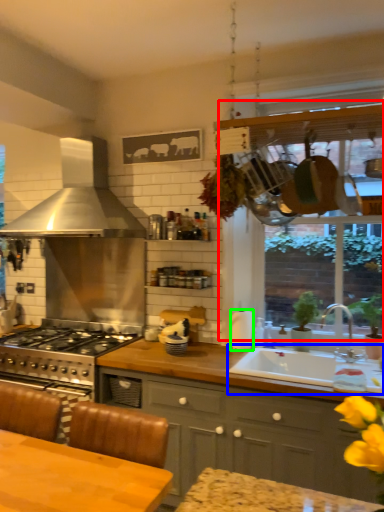
Question: Which object is positioned farthest from window frame (highlighted by a red box)? Select from sink (highlighted by a blue box) and appliance (highlighted by a green box).

Choices:
 (A) sink
 (B) appliance

Answer: (B)